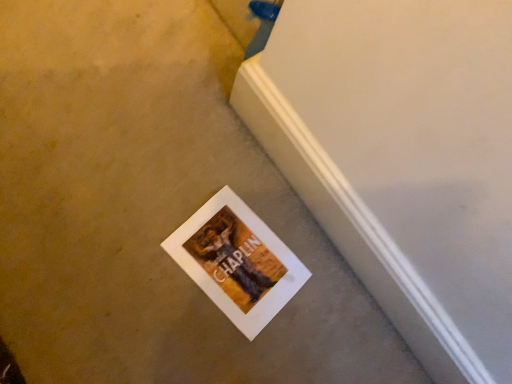
Measure the distance between white matte picture frame at lower center and camera.

The distance of white matte picture frame at lower center from camera is 95.60 centimeters.

The width and height of the screenshot is (512, 384). I want to click on white matte picture frame at lower center, so coord(237,261).

The height and width of the screenshot is (384, 512). Describe the element at coordinates (237, 261) in the screenshot. I see `white matte picture frame at lower center` at that location.

Identify the location of white matte picture frame at lower center. The height and width of the screenshot is (384, 512). (237, 261).